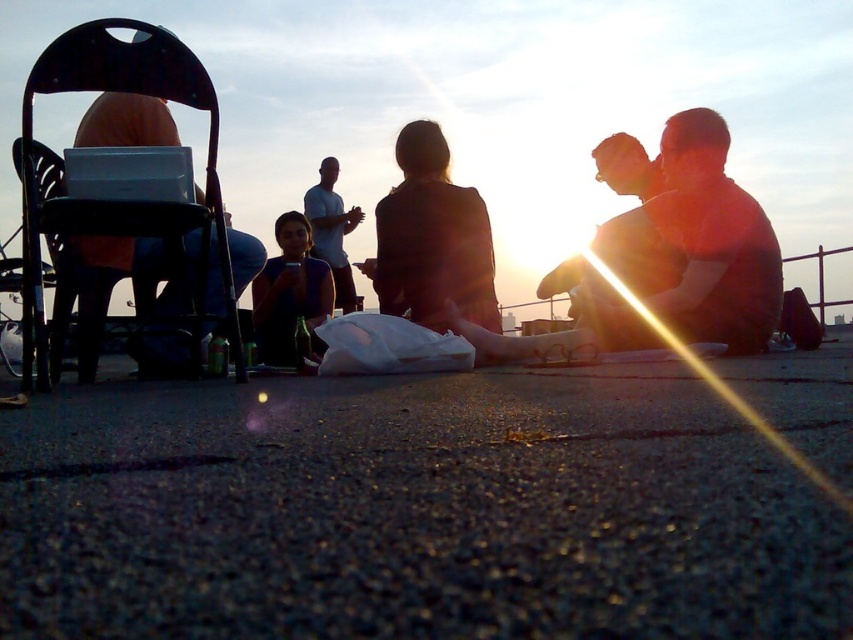
Question: Where is black plastic chair at left located in relation to white cotton shirt at center in the image?

Choices:
 (A) below
 (B) above

Answer: (A)

Question: Which of the following is the farthest from the observer?

Choices:
 (A) black plastic chair at left
 (B) matte black shirt at center
 (C) silhouette fabric jacket at center

Answer: (C)

Question: Does black plastic chair at left have a lesser width compared to matte black shirt at center?

Choices:
 (A) yes
 (B) no

Answer: (A)

Question: Which of the following is the farthest from the observer?

Choices:
 (A) (289, 259)
 (B) (187, 225)

Answer: (A)

Question: Can you confirm if silhouette fabric jacket at center is smaller than matte black shirt at center?

Choices:
 (A) no
 (B) yes

Answer: (B)

Question: Considering the real-world distances, which object is closest to the silhouette fabric jacket at center?

Choices:
 (A) white cotton shirt at center
 (B) black plastic chair at left

Answer: (B)